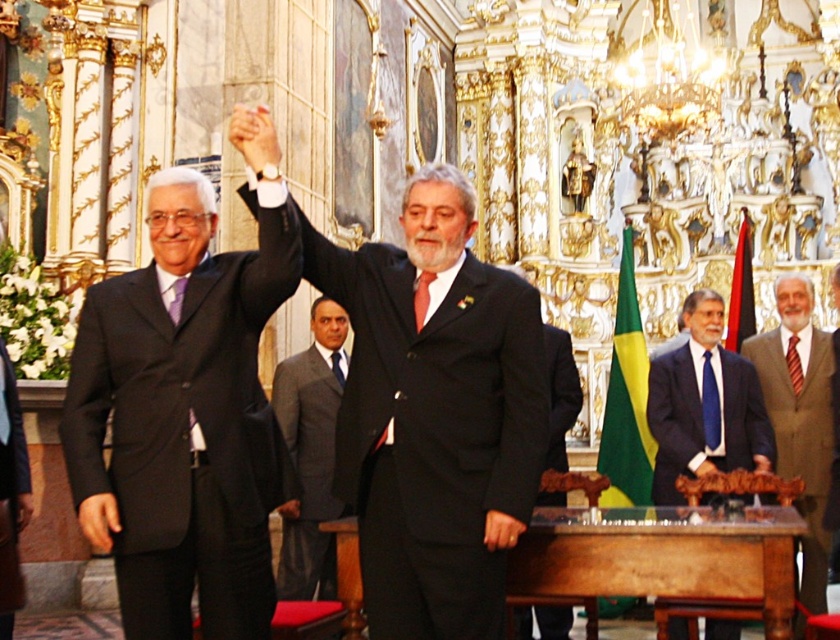
You are attending this formal event and need to place a bouquet of flowers between the wooden altar at center and the blue silk suit at center. Based on their positions, which object should the bouquet be closer to?

The wooden altar at center is positioned on the left side of blue silk suit at center, so the bouquet should be placed closer to the wooden altar at center to maintain symmetry between the two objects.

You are standing in the grand hall and want to locate the brown wool suit at right. According to the coordinates provided, where would you find it?

The brown wool suit at right is located at coordinates point (801, 419).